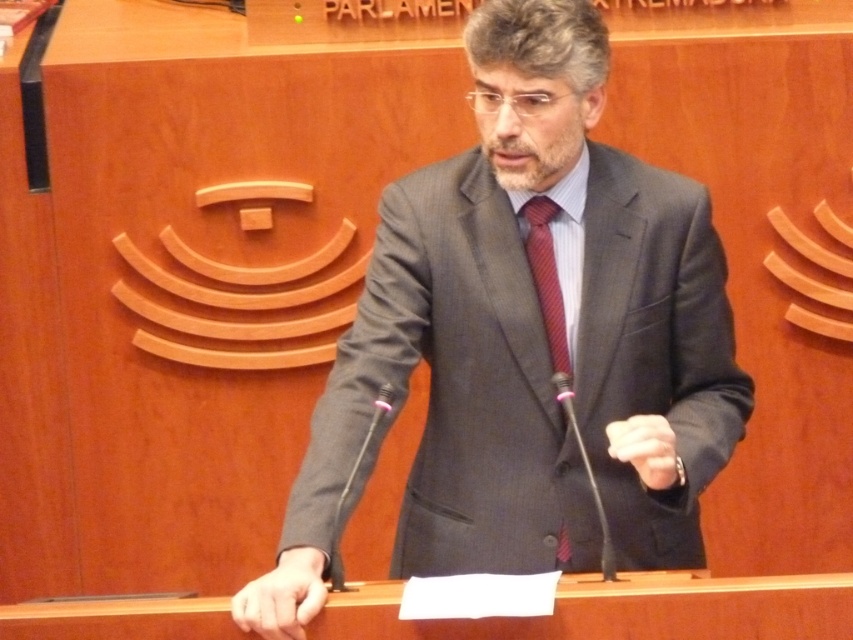
You are an observer in the Parliament of Extremadura. You notice a man dressed in a matte gray suit at center and a red striped tie at center. Which item is positioned lower on his body?

The matte gray suit at center is positioned lower on his body than the red striped tie at center, as the description states the matte gray suit at center is below red striped tie at center.

You are standing in the parliamentary chamber and want to place a small plant on the podium. The podium is at point (x=514, y=480). If the plant requires 2 feet of space from the viewer, will it fit?

The distance of point (x=514, y=480) from the viewer is 6.05 feet, which is more than the required 2 feet, so the plant will fit.

You are a fashion designer observing the man in the parliamentary chamber. You need to determine which item of clothing is higher on his body between the matte gray suit at center and the red striped tie at center. Which one is higher?

The matte gray suit at center is much taller than the red striped tie at center, so the matte gray suit at center is higher on his body.